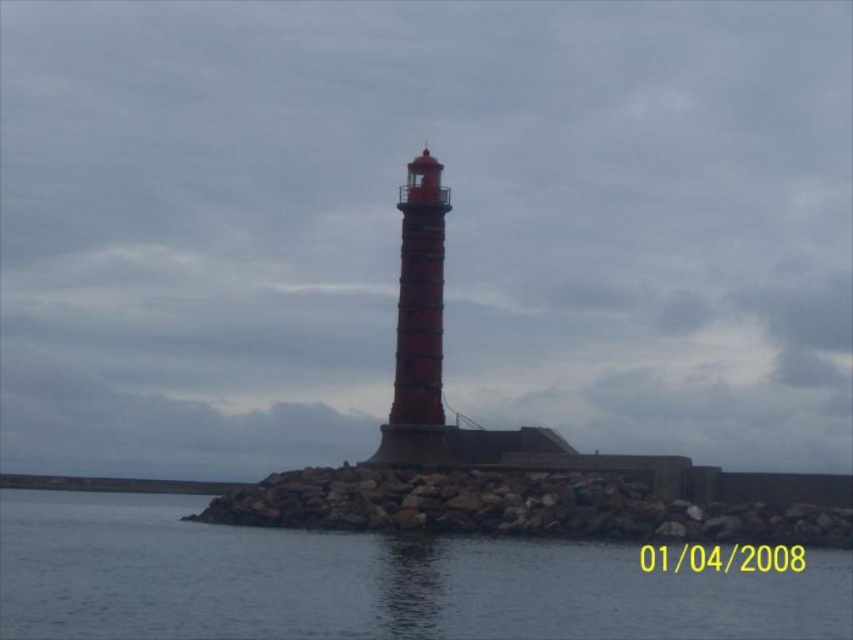
From the picture: You are standing at the base of the lighthouse and looking out towards the rocky outcrop. There are two points marked on the outcrop. Which point, point (233,632) or point (369,524), is closer to you?

Point (233,632) is closer to you than point (369,524).

You are standing on the rocky outcrop and want to cross to the lighthouse. You see the transparent water at lower center and the rocky at center. Which path is closer to you to reach the lighthouse?

The transparent water at lower center is closer to the viewer than the rocky at center, so you should take the path through the transparent water at lower center to reach the lighthouse.